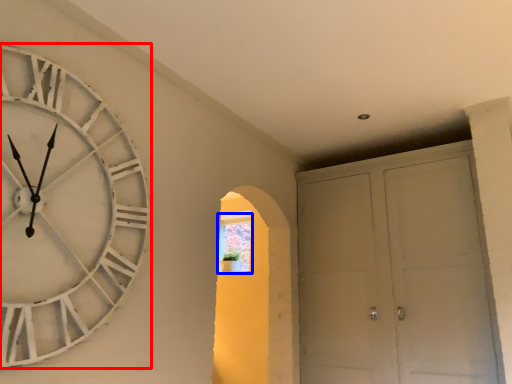
Question: Which object is closer to the camera taking this photo, wall clock (highlighted by a red box) or window (highlighted by a blue box)?

Choices:
 (A) wall clock
 (B) window

Answer: (A)